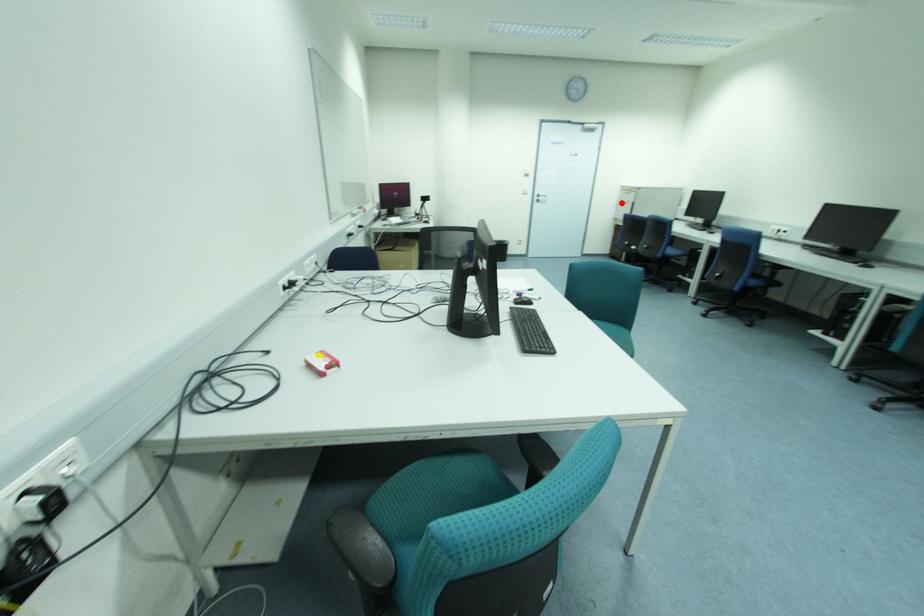
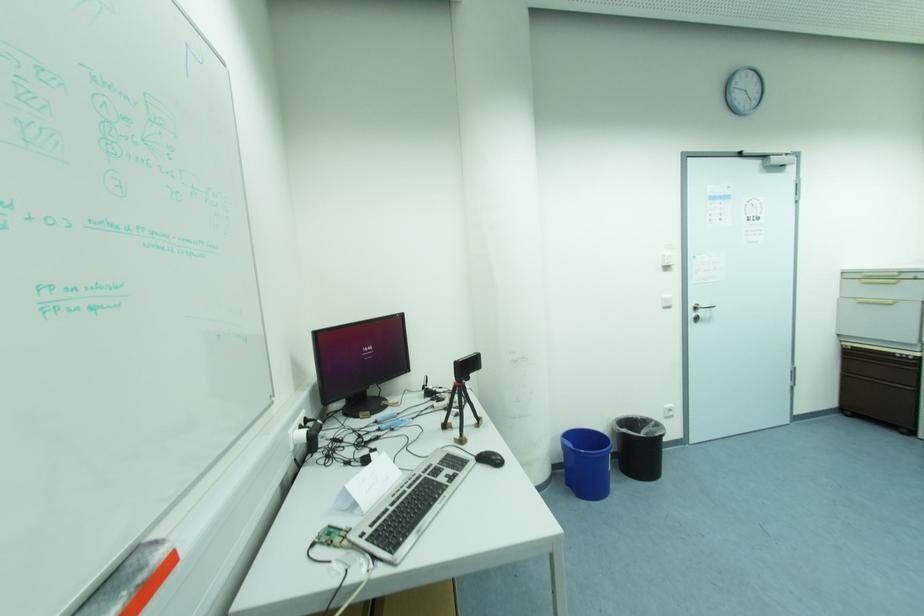
Question: A red point is marked in image1. In image2, is the corresponding 3D point closer to the camera or farther? Reply with the corresponding letter.

Choices:
 (A) The corresponding 3D point is closer.
 (B) The corresponding 3D point is farther.

Answer: (B)